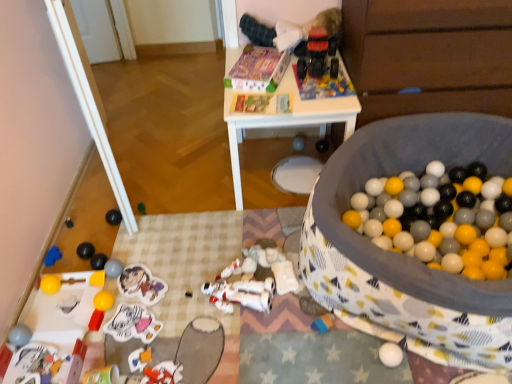
You are a GUI agent. You are given a task and a screenshot of the screen. Output one action in this format:
    pyautogui.click(x=<x>, y=<y>)
    Task: Click on the vacant area that lies between white matte robot at center, marked as the fifteenth toy in a left-to-right arrangement, and matte gray ball at lower left, which appears as the 12th toy when viewed from the right
    
    Given the screenshot: What is the action you would take?
    pyautogui.click(x=167, y=284)